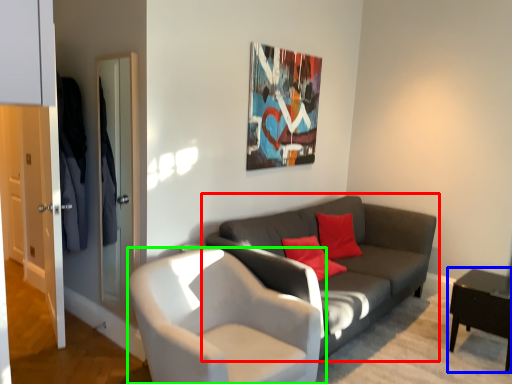
Question: Which object is the farthest from studio couch (highlighted by a red box)? Choose among these: table (highlighted by a blue box) or chair (highlighted by a green box).

Choices:
 (A) table
 (B) chair

Answer: (A)